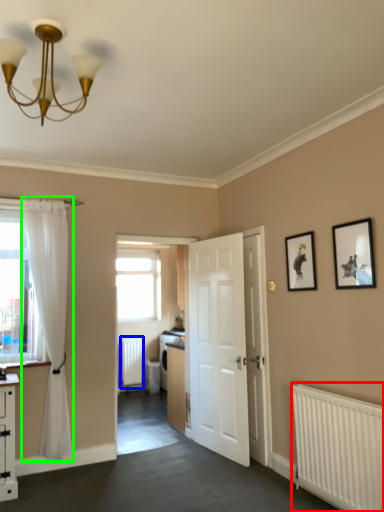
Question: Considering the real-world distances, which object is farthest from radiator (highlighted by a red box)? radiator (highlighted by a blue box) or curtain (highlighted by a green box)?

Choices:
 (A) radiator
 (B) curtain

Answer: (A)